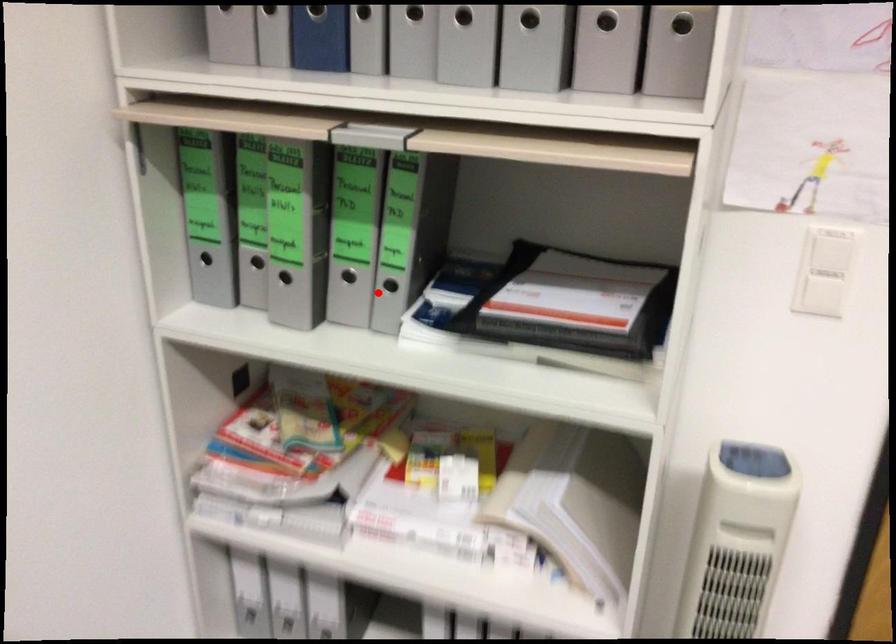
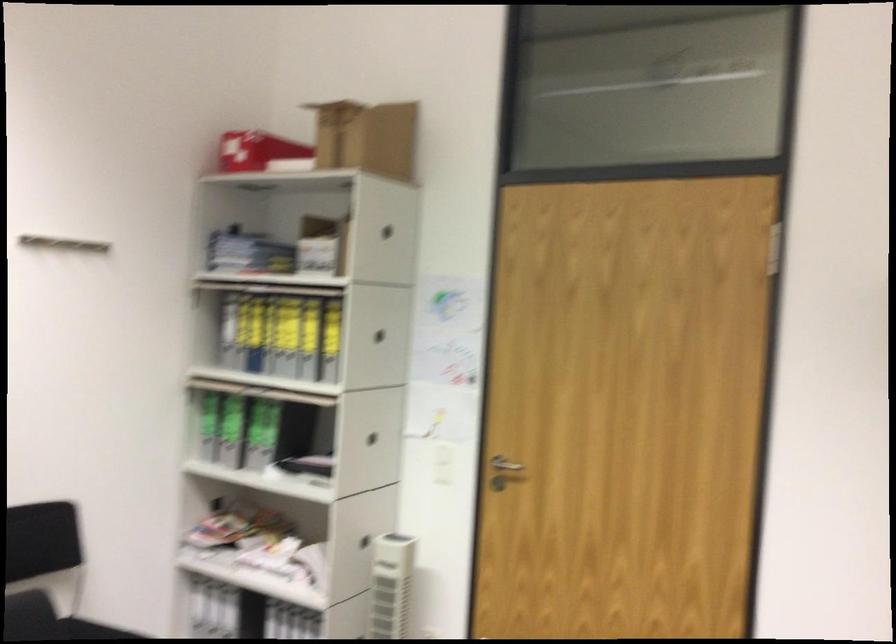
In the second image, find the point that corresponds to the highlighted location in the first image.

(265, 453)